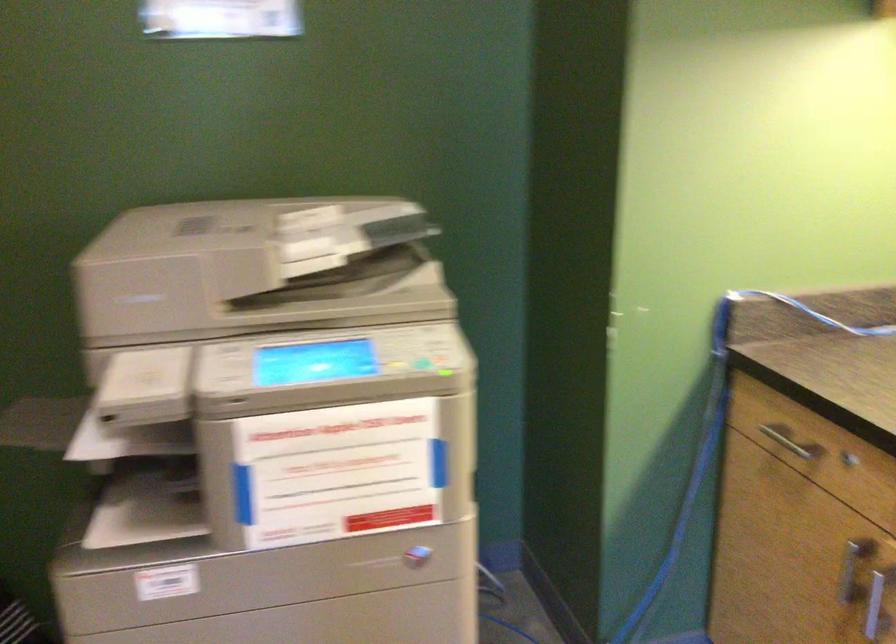
First-person continuous shooting, in which direction is the camera rotating?

The camera rotated toward right-down.